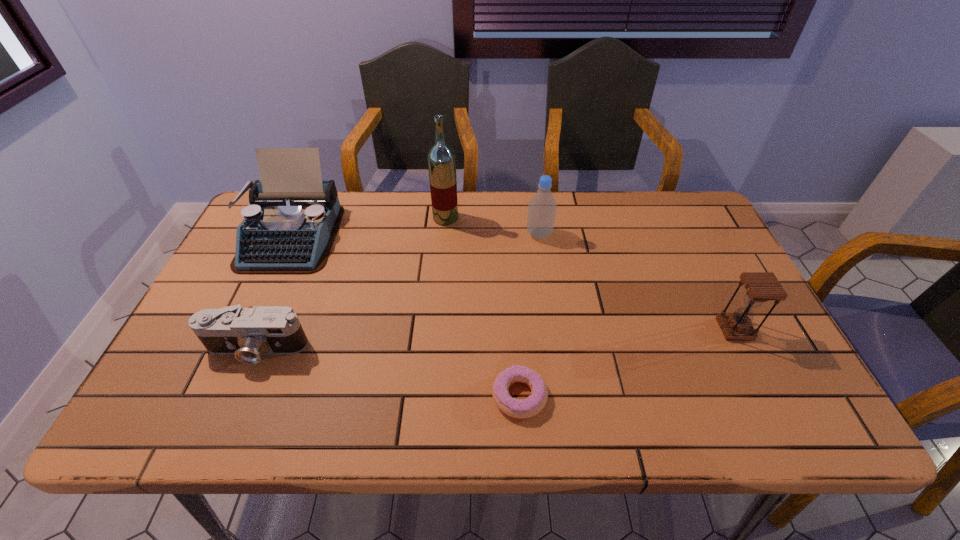
Find the location of `free spot located 0.200m on the typing side of the typewriter`. free spot located 0.200m on the typing side of the typewriter is located at coordinates (246, 333).

Identify the location of free space located 0.110m on the front of the bottle. Image resolution: width=960 pixels, height=540 pixels. (544, 269).

Locate an element on the screen. blank space located on the front of the hourglass is located at coordinates (771, 402).

The width and height of the screenshot is (960, 540). Identify the location of vacant space situated 0.120m on the lens of the camera. (227, 418).

At what (x,y) coordinates should I click in order to perform the action: click on blank space located 0.240m on the back of the doughnut. Please return your answer as a coordinate pair (x, y). The image size is (960, 540). Looking at the image, I should click on (513, 293).

I want to click on liquor at the far edge, so click(441, 158).

The image size is (960, 540). Identify the location of typewriter present at the far edge. (289, 227).

Where is `bottle present at the far edge`? This screenshot has width=960, height=540. bottle present at the far edge is located at coordinates (542, 207).

Where is `object that is positioned at the near edge`? Image resolution: width=960 pixels, height=540 pixels. object that is positioned at the near edge is located at coordinates (513, 407).

The height and width of the screenshot is (540, 960). I want to click on typewriter that is at the left edge, so click(x=289, y=227).